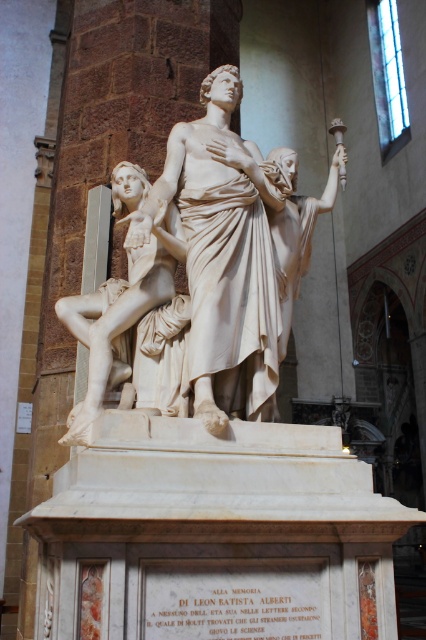
Question: Among these objects, which one is farthest from the camera?

Choices:
 (A) white marble statue at left
 (B) white marble statue at center

Answer: (A)

Question: Among these points, which one is farthest from the camera?

Choices:
 (A) (181, 218)
 (B) (94, 362)

Answer: (A)

Question: Where is white marble statue at center located in relation to white marble statue at left in the image?

Choices:
 (A) below
 (B) above

Answer: (A)

Question: Is white marble statue at center closer to camera compared to white marble statue at left?

Choices:
 (A) no
 (B) yes

Answer: (B)

Question: Can you confirm if white marble statue at center is bigger than white marble statue at left?

Choices:
 (A) no
 (B) yes

Answer: (A)